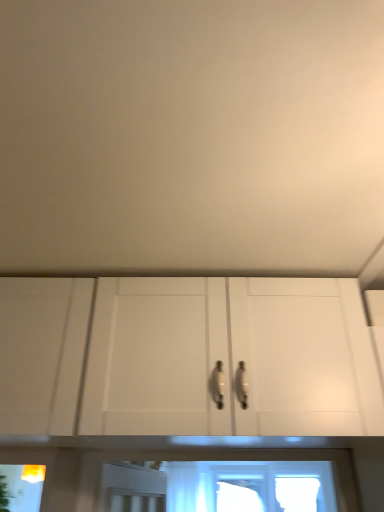
Image resolution: width=384 pixels, height=512 pixels. What do you see at coordinates (33, 473) in the screenshot? I see `yellow plastic light fixture at lower left` at bounding box center [33, 473].

Locate an element on the screen. white matte cabinet at center is located at coordinates (304, 357).

From a real-world perspective, which is physically above, yellow plastic light fixture at lower left or white matte cabinet at center?

white matte cabinet at center is physically above.

From the picture: Are yellow plastic light fixture at lower left and white matte cabinet at center located far from each other?

No, yellow plastic light fixture at lower left is not far from white matte cabinet at center.

Is white matte cabinet at center aimed at green leafy plant at lower left?

No, white matte cabinet at center is not turned towards green leafy plant at lower left.

In the scene shown: Considering the positions of objects white matte cabinet at center and green leafy plant at lower left in the image provided, who is more to the left, white matte cabinet at center or green leafy plant at lower left?

From the viewer's perspective, green leafy plant at lower left appears more on the left side.

Considering the points (268, 338) and (6, 498), which point is behind, point (268, 338) or point (6, 498)?

The point (6, 498) is farther from the camera.

From the image's perspective, which is above, white matte cabinet at center or green leafy plant at lower left?

white matte cabinet at center.

In the image, is green leafy plant at lower left positioned in front of or behind yellow plastic light fixture at lower left?

green leafy plant at lower left is behind yellow plastic light fixture at lower left.

Is green leafy plant at lower left inside the boundaries of yellow plastic light fixture at lower left, or outside?

green leafy plant at lower left cannot be found inside yellow plastic light fixture at lower left.

From the image's perspective, which is below, green leafy plant at lower left or yellow plastic light fixture at lower left?

green leafy plant at lower left is shown below in the image.

Which of these two, green leafy plant at lower left or yellow plastic light fixture at lower left, stands shorter?

yellow plastic light fixture at lower left.

Where is `plant on the left of yellow plastic light fixture at lower left`? Image resolution: width=384 pixels, height=512 pixels. plant on the left of yellow plastic light fixture at lower left is located at coordinates (4, 494).

From the image's perspective, is yellow plastic light fixture at lower left under green leafy plant at lower left?

Incorrect, from the image's perspective, yellow plastic light fixture at lower left is higher than green leafy plant at lower left.

Is yellow plastic light fixture at lower left directly adjacent to green leafy plant at lower left?

No, yellow plastic light fixture at lower left is not beside green leafy plant at lower left.

Is yellow plastic light fixture at lower left behind green leafy plant at lower left?

No, it is not.

Which object is further away from the camera, green leafy plant at lower left or white matte cabinet at center?

green leafy plant at lower left is behind.

Is green leafy plant at lower left to the left of white matte cabinet at center from the viewer's perspective?

Yes.

How many degrees apart are the facing directions of green leafy plant at lower left and white matte cabinet at center?

The angular difference between green leafy plant at lower left and white matte cabinet at center is 93 degrees.

Between green leafy plant at lower left and white matte cabinet at center, which one has smaller size?

With smaller size is green leafy plant at lower left.

Are white matte cabinet at center and yellow plastic light fixture at lower left far apart?

They are positioned close to each other.

From the image's perspective, does white matte cabinet at center appear higher than yellow plastic light fixture at lower left?

Yes, from the image's perspective, white matte cabinet at center is over yellow plastic light fixture at lower left.

Consider the image. Is yellow plastic light fixture at lower left located within white matte cabinet at center?

No, yellow plastic light fixture at lower left is not surrounded by white matte cabinet at center.

This screenshot has width=384, height=512. What are the coordinates of `light fixture below the white matte cabinet at center (from the image's perspective)` in the screenshot? It's located at (33, 473).

At what (x,y) coordinates should I click in order to perform the action: click on cabinetry in front of the green leafy plant at lower left. Please return your answer as a coordinate pair (x, y). The image size is (384, 512). Looking at the image, I should click on (304, 357).

When comparing their distances from yellow plastic light fixture at lower left, does white matte cabinet at center or green leafy plant at lower left seem further?

Among the two, white matte cabinet at center is located further to yellow plastic light fixture at lower left.

Estimate the real-world distances between objects in this image. Which object is further from yellow plastic light fixture at lower left, green leafy plant at lower left or white matte cabinet at center?

white matte cabinet at center.

Considering their positions, is yellow plastic light fixture at lower left positioned closer to white matte cabinet at center than green leafy plant at lower left?

yellow plastic light fixture at lower left is positioned closer to the anchor white matte cabinet at center.

Considering their positions, is green leafy plant at lower left positioned closer to white matte cabinet at center than yellow plastic light fixture at lower left?

Based on the image, yellow plastic light fixture at lower left appears to be nearer to white matte cabinet at center.

From the picture: Based on their spatial positions, is white matte cabinet at center or yellow plastic light fixture at lower left further from green leafy plant at lower left?

white matte cabinet at center is further to green leafy plant at lower left.

Considering their positions, is yellow plastic light fixture at lower left positioned closer to green leafy plant at lower left than white matte cabinet at center?

yellow plastic light fixture at lower left lies closer to green leafy plant at lower left than the other object.

Locate an element on the screen. The width and height of the screenshot is (384, 512). light fixture located between white matte cabinet at center and green leafy plant at lower left in the depth direction is located at coordinates (33, 473).